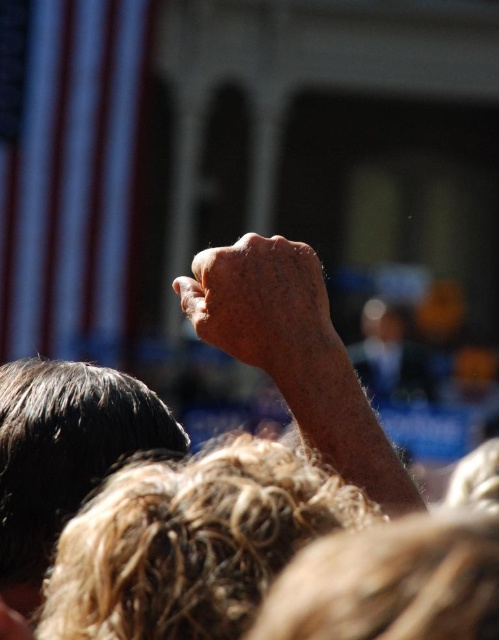
You are a photographer at an outdoor event. You notice the dry skin at center and the dark brown hair at upper left in your frame. Which object is positioned higher in the image?

The dry skin at center is positioned higher than the dark brown hair at upper left in the image.

You are a photographer trying to capture the details of the dry skin at center and the dark brown hair at upper left in this image. Based on their sizes, which object would require you to use a closer zoom to focus on its details?

The dry skin at center has a smaller size compared to the dark brown hair at upper left, so you would need to use a closer zoom to focus on the details of the dry skin at center.